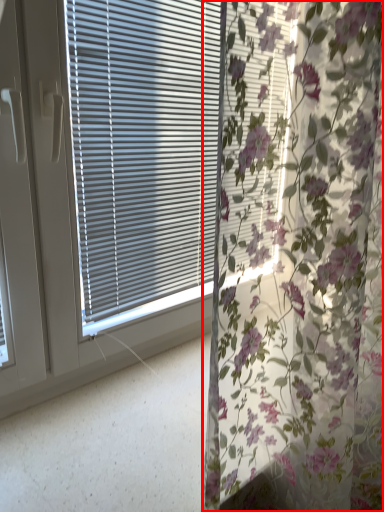
Question: From the image's perspective, where is curtain (annotated by the red box) located relative to window blind?

Choices:
 (A) below
 (B) above

Answer: (A)